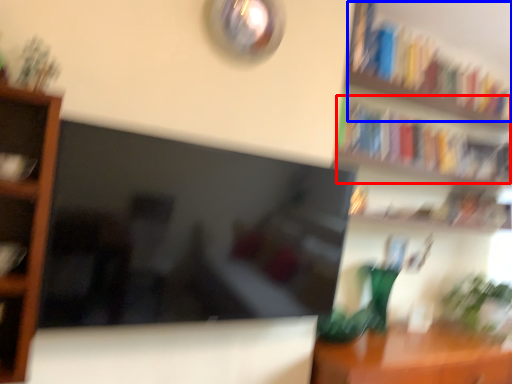
Question: Which of the following is the closest to the observer, book (highlighted by a red box) or book (highlighted by a blue box)?

Choices:
 (A) book
 (B) book

Answer: (B)